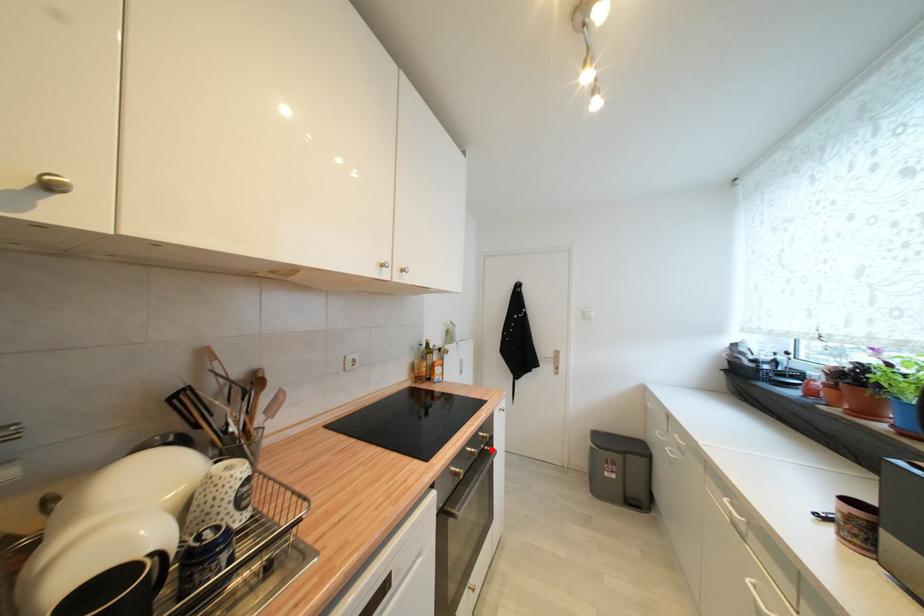
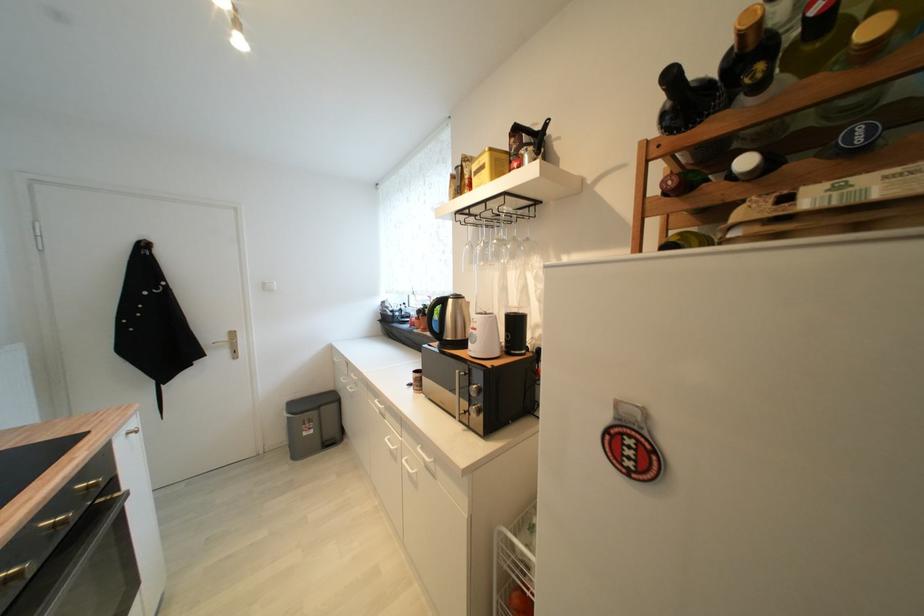
Locate, in the second image, the point that corresponds to the highlighted location in the first image.

(107, 503)